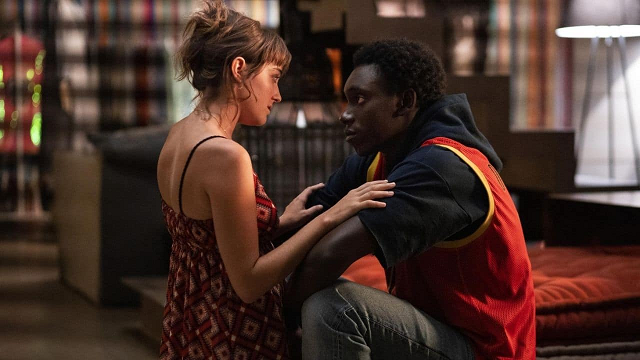
The height and width of the screenshot is (360, 640). In order to click on lamp in this screenshot , I will do click(x=601, y=11).